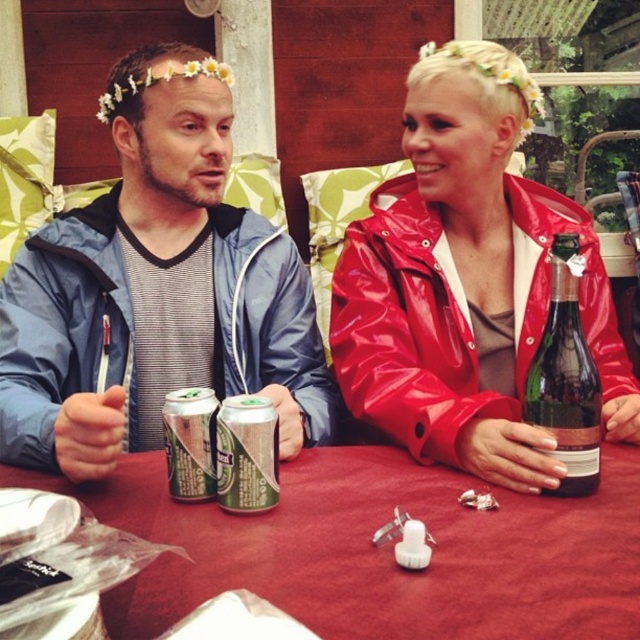
Question: Which of the following is the farthest from the observer?

Choices:
 (A) (134, 506)
 (B) (467, 332)

Answer: (B)

Question: Can you confirm if green metallic can at center is smaller than silver metallic can at center?

Choices:
 (A) yes
 (B) no

Answer: (A)

Question: Which point appears closest to the camera in this image?

Choices:
 (A) (451, 605)
 (B) (35, 280)
 (C) (596, 419)
 (D) (248, 499)

Answer: (A)

Question: Considering the relative positions of green metallic can at center and silver metallic can at center in the image provided, where is green metallic can at center located with respect to silver metallic can at center?

Choices:
 (A) left
 (B) right

Answer: (B)

Question: Which point is farther from the camera taking this photo?

Choices:
 (A) (426, 221)
 (B) (168, 76)
 (C) (556, 380)
 (D) (220, 406)

Answer: (A)

Question: Does shiny red raincoat at center appear on the right side of green metallic can at center?

Choices:
 (A) no
 (B) yes

Answer: (B)